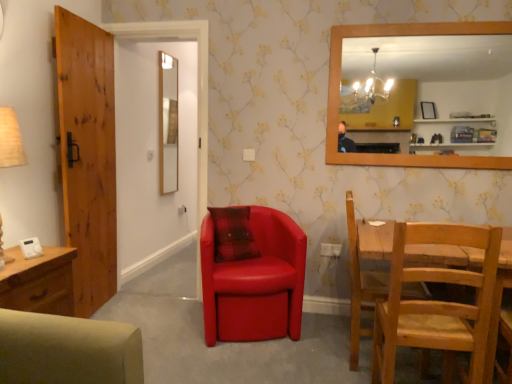
Where is `free space to the left of light brown wooden chair at lower right, positioned as the 1th chair in right-to-left order`? The image size is (512, 384). free space to the left of light brown wooden chair at lower right, positioned as the 1th chair in right-to-left order is located at coordinates click(x=305, y=344).